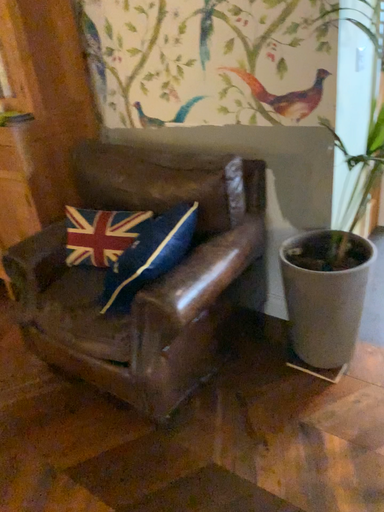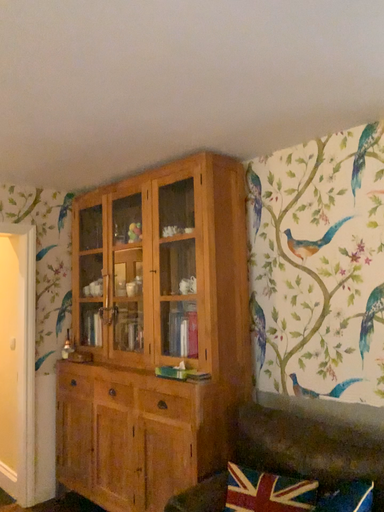
Question: Which way did the camera rotate in the video?

Choices:
 (A) rotated upward
 (B) rotated downward

Answer: (A)